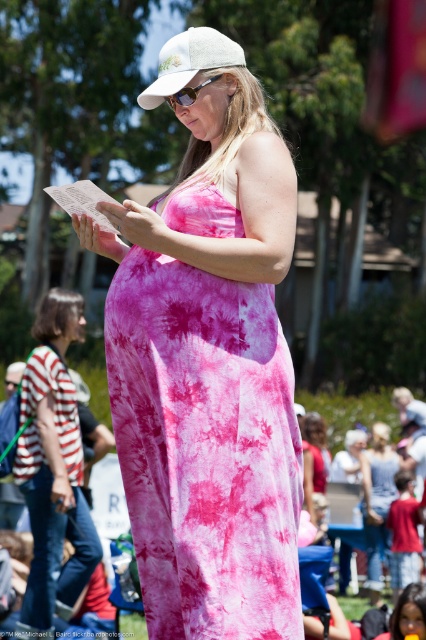
Can you confirm if tie-dye fabric maxi dress at center is taller than white fabric baseball cap at upper center?

No, tie-dye fabric maxi dress at center is not taller than white fabric baseball cap at upper center.

Can you confirm if tie-dye fabric maxi dress at center is wider than white fabric baseball cap at upper center?

No.

Who is more distant from viewer, (69, 420) or (178, 68)?

Positioned behind is point (69, 420).

Locate an element on the screen. tie-dye fabric maxi dress at center is located at coordinates (54, 468).

Is tie-dye fabric dress at center bigger than tie-dye fabric maxi dress at center?

No.

Between tie-dye fabric dress at center and tie-dye fabric maxi dress at center, which one has more height?

tie-dye fabric maxi dress at center is taller.

At what (x,y) coordinates should I click in order to perform the action: click on tie-dye fabric dress at center. Please return your answer as a coordinate pair (x, y). Looking at the image, I should click on (206, 449).

Between point (287, 433) and point (184, 76), which one is positioned in front?

Point (287, 433) is more forward.

Is tie-dye fabric dress at center above white fabric baseball cap at upper center?

Incorrect, tie-dye fabric dress at center is not positioned above white fabric baseball cap at upper center.

Does point (253, 497) come closer to viewer compared to point (201, 44)?

Yes, it is in front of point (201, 44).

Where is `tie-dye fabric dress at center`? tie-dye fabric dress at center is located at coordinates (206, 449).